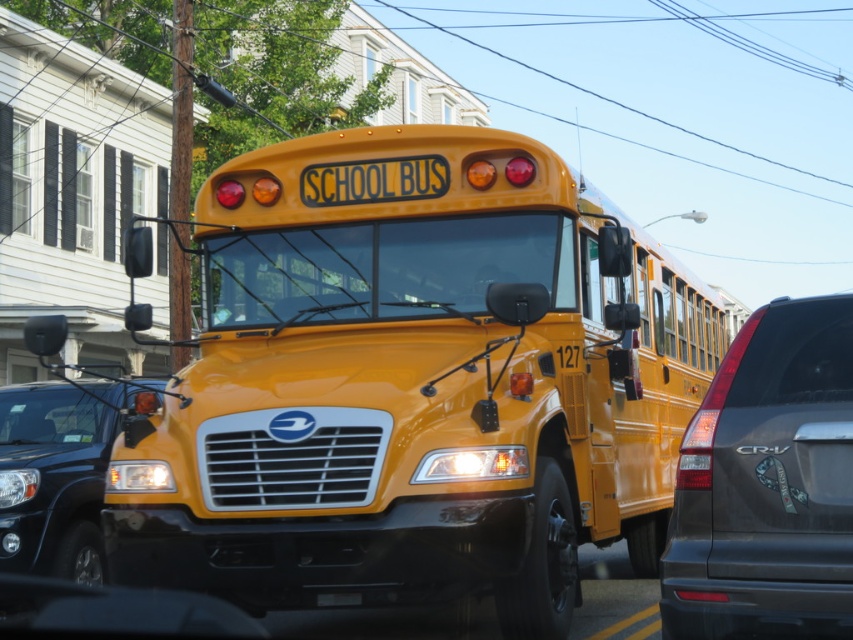
Does matte black suv at right have a smaller size compared to yellow matte license plate at center?

No, matte black suv at right is not smaller than yellow matte license plate at center.

Who is positioned more to the right, matte black suv at right or yellow matte license plate at center?

Positioned to the right is matte black suv at right.

Who is more distant from viewer, (715, 429) or (349, 605)?

Positioned behind is point (349, 605).

The height and width of the screenshot is (640, 853). What are the coordinates of `matte black suv at right` in the screenshot? It's located at (767, 483).

Who is lower down, yellow matte/solid school bus at center or glossy black suv at left?

glossy black suv at left

Does point (526, 273) come behind point (48, 509)?

No.

Between point (596, 216) and point (97, 564), which one is positioned behind?

Point (97, 564)

Where is `yellow matte/solid school bus at center`? The image size is (853, 640). yellow matte/solid school bus at center is located at coordinates (413, 381).

Can you confirm if yellow matte/solid school bus at center is taller than yellow matte license plate at center?

Indeed, yellow matte/solid school bus at center has a greater height compared to yellow matte license plate at center.

Who is positioned more to the left, yellow matte/solid school bus at center or yellow matte license plate at center?

From the viewer's perspective, yellow matte license plate at center appears more on the left side.

Who is more distant from viewer, (215, 374) or (352, 602)?

Point (215, 374)

Image resolution: width=853 pixels, height=640 pixels. Identify the location of yellow matte/solid school bus at center. pos(413,381).